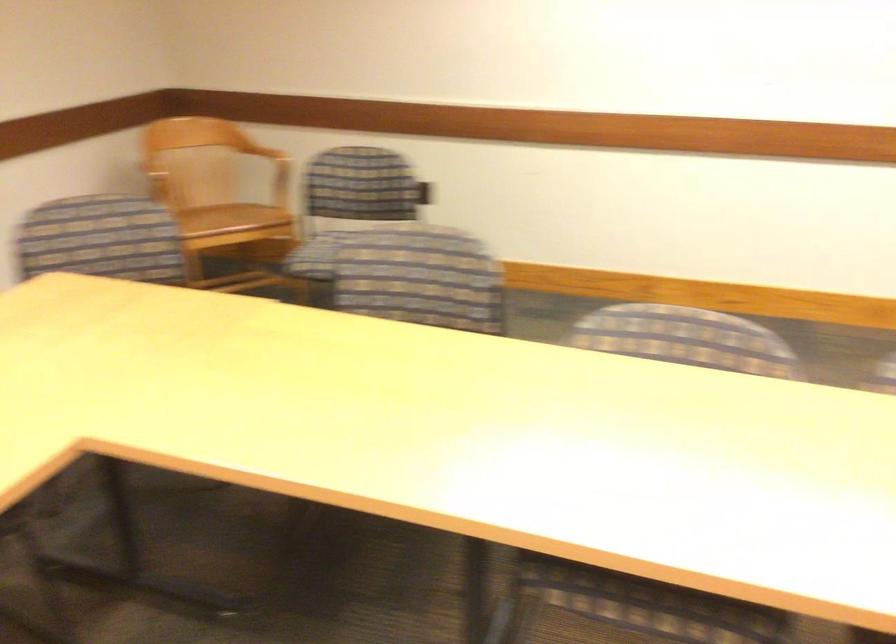
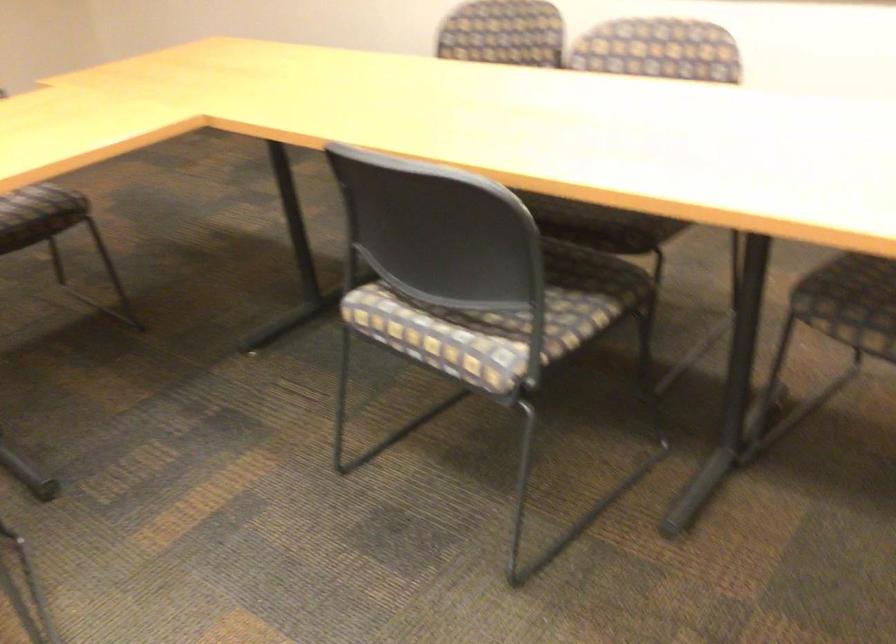
Based on the continuous images, in which direction is the camera rotating?

The camera's rotation is toward left-down.